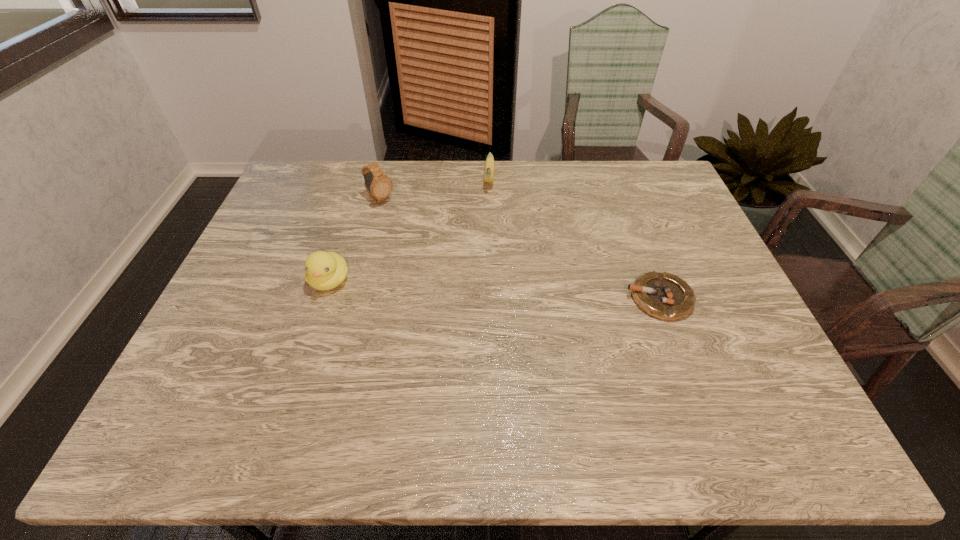
Find the location of a particular element. This screenshot has height=540, width=960. vacant region located 0.190m on the face of the watch is located at coordinates (427, 236).

Find the location of a particular element. free space located 0.130m at the stem of the third object from left to right is located at coordinates (488, 222).

This screenshot has width=960, height=540. In order to click on vacant space located 0.160m at the stem of the third object from left to right in this screenshot , I will do `click(488, 228)`.

You are a GUI agent. You are given a task and a screenshot of the screen. Output one action in this format:
    pyautogui.click(x=<x>, y=<y>)
    Task: Click on the free space located 0.190m at the stem of the third object from left to right
    
    Given the screenshot: What is the action you would take?
    pyautogui.click(x=487, y=235)

You are a GUI agent. You are given a task and a screenshot of the screen. Output one action in this format:
    pyautogui.click(x=<x>, y=<y>)
    Task: Click on the watch that is positioned at the far edge
    The width and height of the screenshot is (960, 540).
    Given the screenshot: What is the action you would take?
    pyautogui.click(x=379, y=187)

Where is `banana located at the far edge`? The width and height of the screenshot is (960, 540). banana located at the far edge is located at coordinates (489, 165).

You are a GUI agent. You are given a task and a screenshot of the screen. Output one action in this format:
    pyautogui.click(x=<x>, y=<y>)
    Task: Click on the object located at the right edge
    
    Given the screenshot: What is the action you would take?
    pyautogui.click(x=665, y=296)

In order to click on vacant space at the far edge in this screenshot , I will do `click(473, 197)`.

This screenshot has width=960, height=540. I want to click on free space at the near edge of the desktop, so click(x=665, y=364).

The width and height of the screenshot is (960, 540). In order to click on free space at the left edge in this screenshot , I will do `click(306, 230)`.